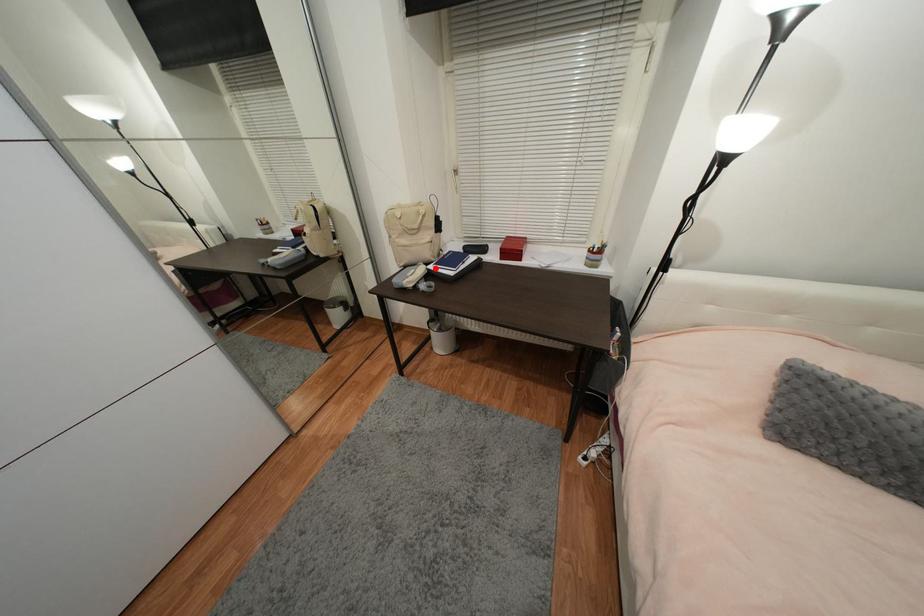
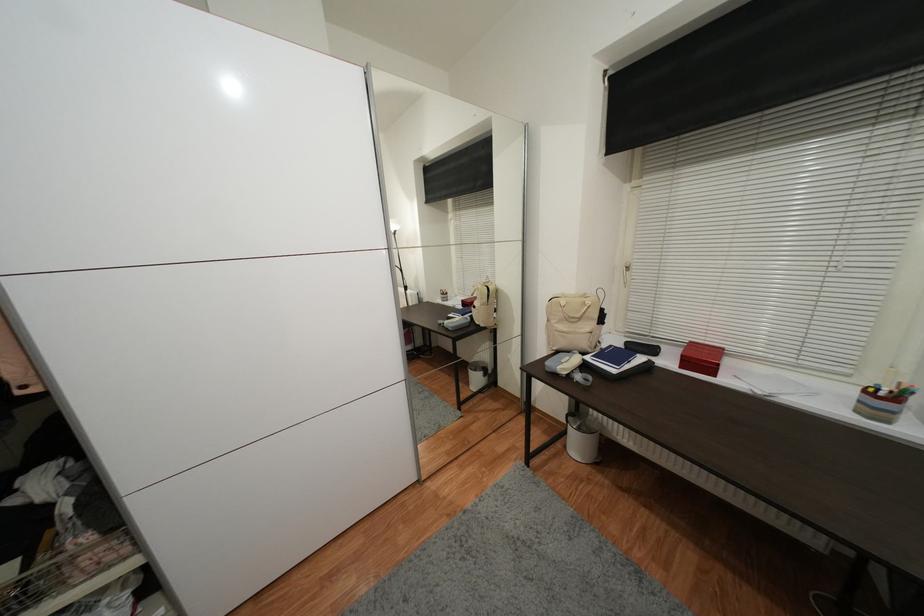
In the second image, find the point that corresponds to the highlighted location in the first image.

(592, 360)